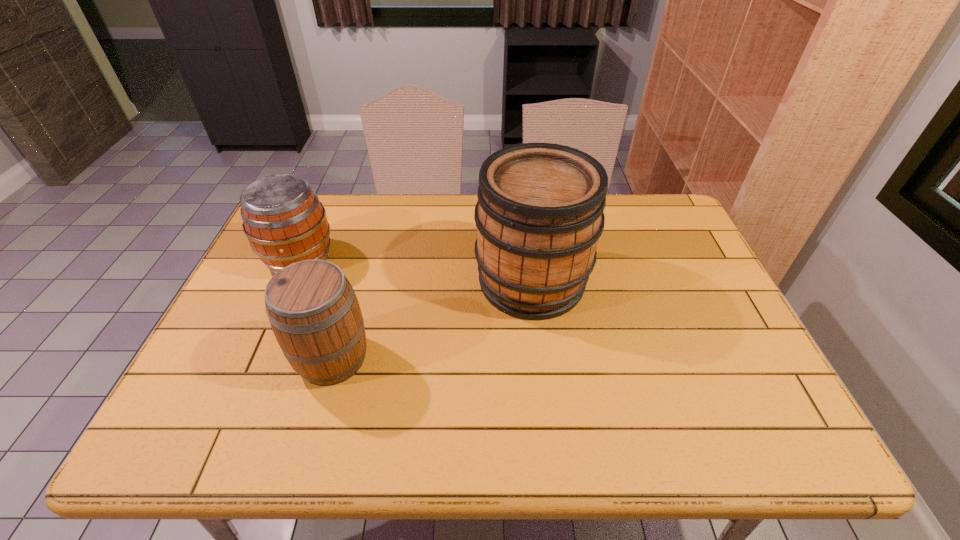
Locate an element on the screen. Image resolution: width=960 pixels, height=540 pixels. the rightmost cider is located at coordinates (539, 215).

Identify the location of the rightmost object. The width and height of the screenshot is (960, 540). (539, 215).

Find the location of `the nearest cider`. the nearest cider is located at coordinates (312, 308).

Find the location of `free region located 0.260m on the left of the tallest cider`. free region located 0.260m on the left of the tallest cider is located at coordinates (383, 281).

Locate an element on the screen. Image resolution: width=960 pixels, height=540 pixels. vacant position located 0.100m on the left of the nearest cider is located at coordinates (252, 358).

I want to click on object located at the far edge, so click(x=283, y=219).

Identify the location of object located at the left edge. (283, 219).

Locate an element on the screen. The width and height of the screenshot is (960, 540). object that is positioned at the far left corner is located at coordinates (283, 219).

Locate an element on the screen. This screenshot has height=540, width=960. free space at the far edge of the desktop is located at coordinates 613,212.

In the image, there is a desktop. Where is `vacant space at the near edge`? vacant space at the near edge is located at coordinates (527, 420).